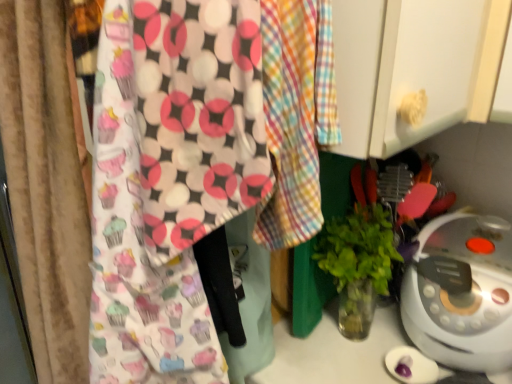
Question: From their relative heights in the image, would you say white plastic rice cooker at lower right is taller or shorter than green leafy plant in clear glass vase at center-right?

Choices:
 (A) tall
 (B) short

Answer: (B)

Question: Is white plastic rice cooker at lower right spatially inside green leafy plant in clear glass vase at center-right, or outside of it?

Choices:
 (A) outside
 (B) inside

Answer: (A)

Question: Estimate the real-world distances between objects in this image. Which object is closer to the green leafy plant in clear glass vase at center-right?

Choices:
 (A) cupcake-patterned fabric at center
 (B) white plastic rice cooker at lower right

Answer: (B)

Question: Which object is the closest to the white plastic rice cooker at lower right?

Choices:
 (A) cupcake-patterned fabric at center
 (B) green leafy plant in clear glass vase at center-right

Answer: (B)